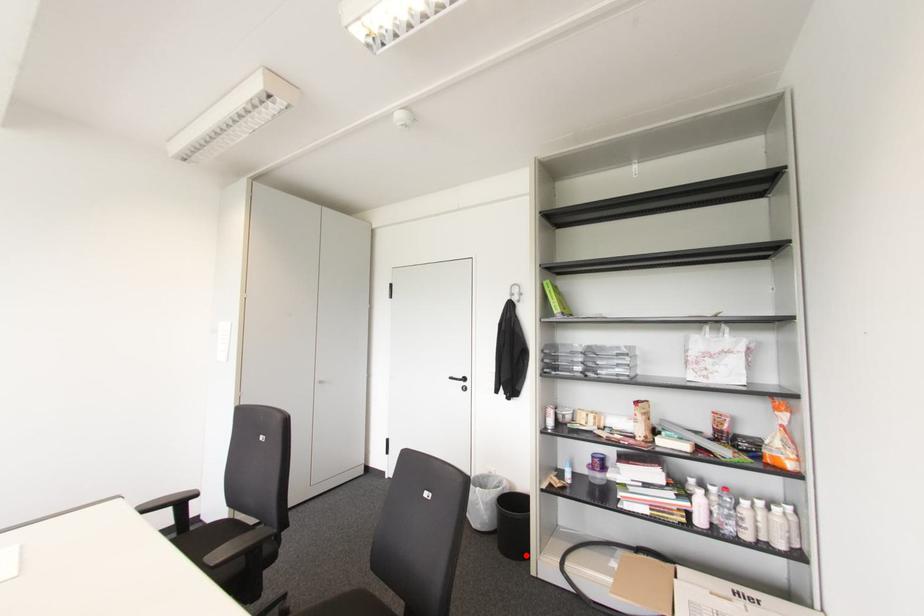
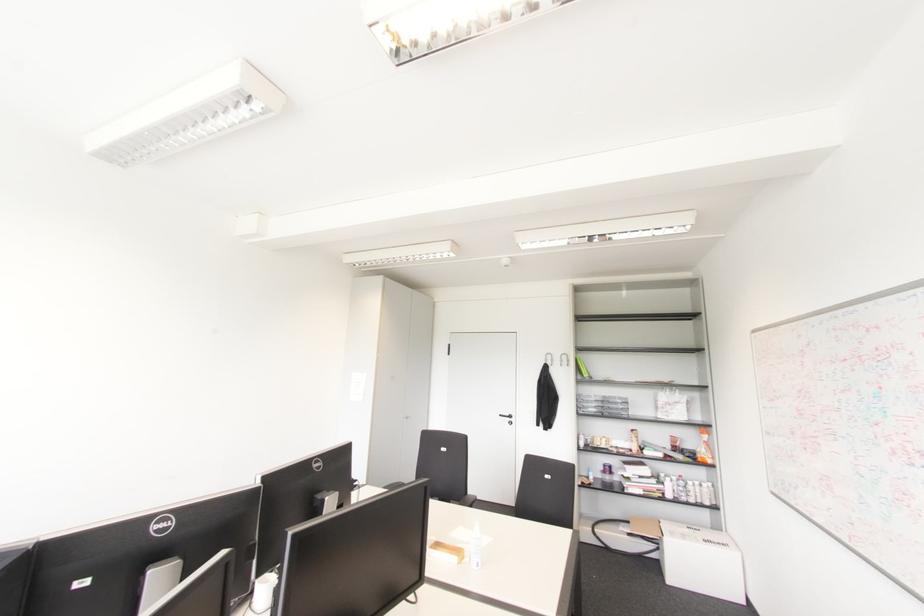
Question: I am providing you with two images of the same scene from different viewpoints. A red point is marked on the first image. Is the red point's position out of view in image 2?

Choices:
 (A) Yes
 (B) No

Answer: (A)